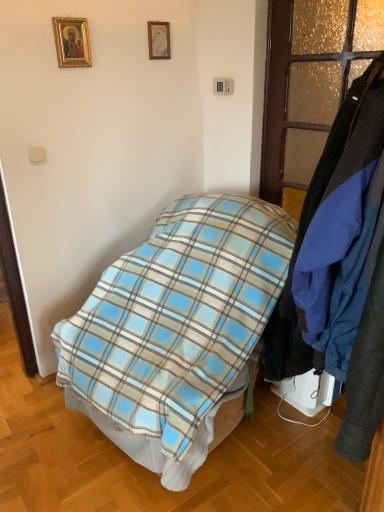
Question: Is matte gold picture frame at upper center, which appears as the first picture frame when viewed from the back, wider than blue plaid blanket at center?

Choices:
 (A) no
 (B) yes

Answer: (A)

Question: Can you confirm if matte gold picture frame at upper center, which is the 2th picture frame from left to right, is positioned to the right of blue plaid blanket at center?

Choices:
 (A) yes
 (B) no

Answer: (B)

Question: From a real-world perspective, does matte gold picture frame at upper center, which appears as the second picture frame when viewed from the front, stand above blue plaid blanket at center?

Choices:
 (A) yes
 (B) no

Answer: (A)

Question: Can you confirm if matte gold picture frame at upper center, which is the 2th picture frame from left to right, is taller than blue plaid blanket at center?

Choices:
 (A) no
 (B) yes

Answer: (A)

Question: Does matte gold picture frame at upper center, which appears as the first picture frame when viewed from the back, contain blue plaid blanket at center?

Choices:
 (A) no
 (B) yes

Answer: (A)

Question: From the image's perspective, would you say matte gold picture frame at upper center, which appears as the first picture frame when viewed from the back, is shown under blue plaid blanket at center?

Choices:
 (A) yes
 (B) no

Answer: (B)

Question: Is matte gold picture frame at upper center, which appears as the second picture frame when viewed from the front, wider than blue fabric coat at right?

Choices:
 (A) yes
 (B) no

Answer: (B)

Question: Is matte gold picture frame at upper center, which appears as the first picture frame when viewed from the back, located outside blue fabric coat at right?

Choices:
 (A) no
 (B) yes

Answer: (B)

Question: Does matte gold picture frame at upper center, which appears as the second picture frame when viewed from the front, appear on the right side of blue fabric coat at right?

Choices:
 (A) no
 (B) yes

Answer: (A)

Question: Is matte gold picture frame at upper center, which appears as the first picture frame when viewed from the back, facing towards blue fabric coat at right?

Choices:
 (A) no
 (B) yes

Answer: (A)

Question: Is matte gold picture frame at upper center, which is the 2th picture frame from left to right, looking in the opposite direction of blue fabric coat at right?

Choices:
 (A) yes
 (B) no

Answer: (B)

Question: Is matte gold picture frame at upper center, which appears as the first picture frame when viewed from the back, thinner than blue fabric coat at right?

Choices:
 (A) yes
 (B) no

Answer: (A)

Question: Could you tell me if blue fabric coat at right is turned towards gold-framed picture at upper left, which ranks as the 1th picture frame in front-to-back order?

Choices:
 (A) yes
 (B) no

Answer: (B)